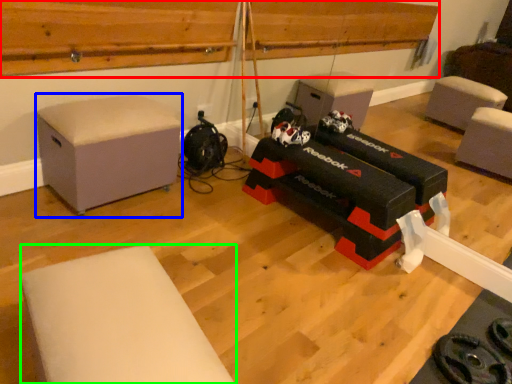
Question: Considering the real-world distances, which object is farthest from wood (highlighted by a red box)? furniture (highlighted by a blue box) or furniture (highlighted by a green box)?

Choices:
 (A) furniture
 (B) furniture

Answer: (B)